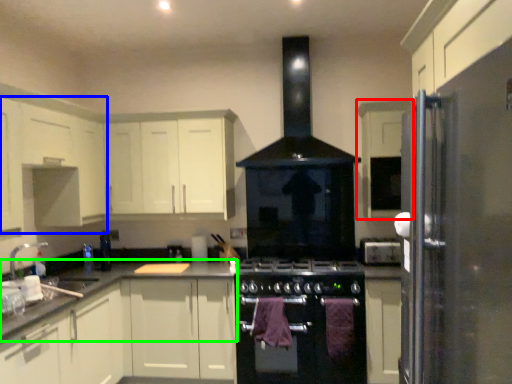
Question: Which object is the farthest from cabinetry (highlighted by a red box)? Choose among these: cabinetry (highlighted by a blue box) or countertop (highlighted by a green box).

Choices:
 (A) cabinetry
 (B) countertop

Answer: (A)